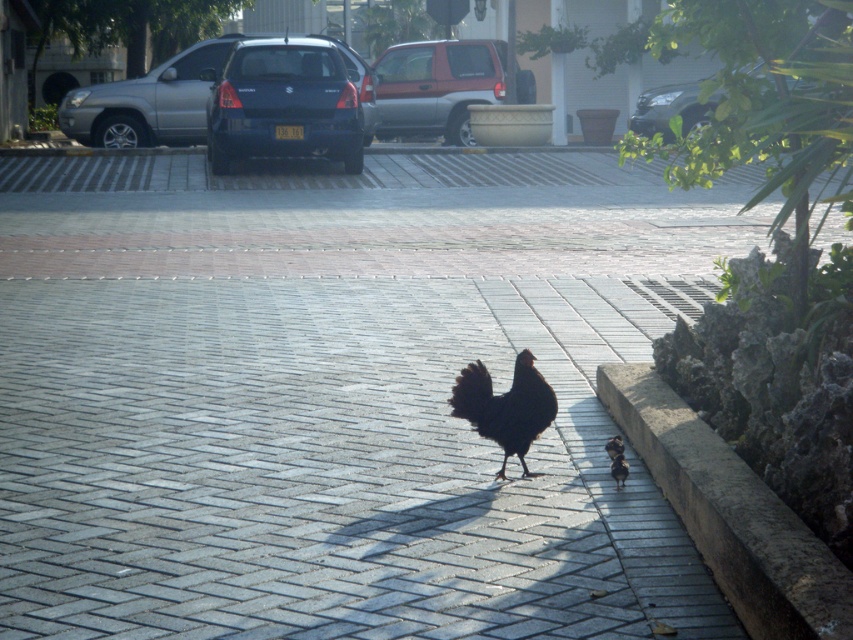
Question: Is brown stone curb at lower right wider than metallic silver suv at upper center?

Choices:
 (A) yes
 (B) no

Answer: (B)

Question: Which point appears closest to the camera in this image?

Choices:
 (A) (265, 134)
 (B) (693, 102)

Answer: (A)

Question: Which of the following is the farthest from the observer?

Choices:
 (A) (180, 129)
 (B) (851, 605)

Answer: (A)

Question: Among these objects, which one is nearest to the camera?

Choices:
 (A) black feathered chicken at center
 (B) matte blue hatchback at center

Answer: (A)

Question: Does matte black car at center have a smaller size compared to black feathered chicken at lower right?

Choices:
 (A) yes
 (B) no

Answer: (B)

Question: Does brown stone curb at lower right come in front of black feathered chicken at lower right?

Choices:
 (A) no
 (B) yes

Answer: (B)